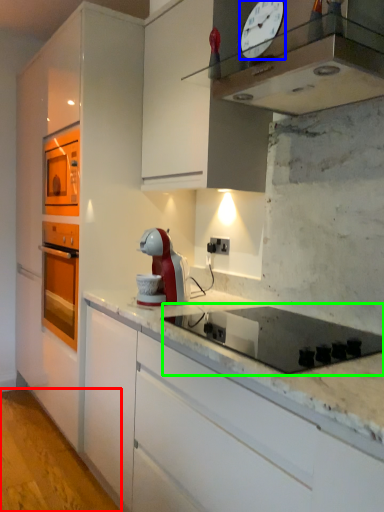
Question: Which object is the closest to the concrete (highlighted by a red box)? Choose among these: clock (highlighted by a blue box) or gas stove (highlighted by a green box).

Choices:
 (A) clock
 (B) gas stove

Answer: (B)